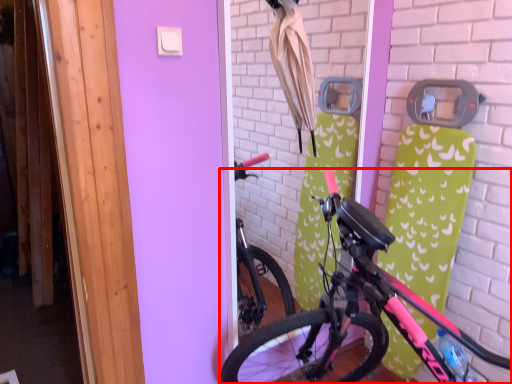
Question: Observing the image, what is the correct spatial positioning of bicycle (annotated by the red box) in reference to umbrella?

Choices:
 (A) right
 (B) left

Answer: (A)